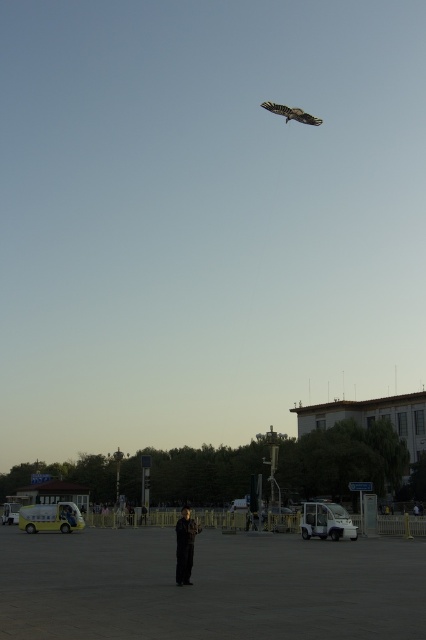
You are a drone operator who needs to fly a drone from the dark gray suit at center to the brown wooden kite at upper center. The drone has a maximum range of 200 feet. Can you safely reach the kite without exceeding the drone range?

The distance between the dark gray suit at center and the brown wooden kite at upper center is 200.17 feet, which exceeds the drone range of 200 feet. Therefore, the drone cannot safely reach the kite without exceeding its maximum range.

You are standing in the plaza and want to walk from point (187, 580) to point (314, 120). Which direction should you move to get closer to your destination?

To move from point (187, 580) to point (314, 120), you should move towards the direction away from the viewer since point (314, 120) is further away than point (187, 580).

You are a photographer trying to capture a clear photo of the dark gray suit at center without the brown wooden kite at upper center appearing in the frame. What adjustment can you make to your camera position to achieve this?

Since the dark gray suit at center is in front of the brown wooden kite at upper center, you can move your camera position lower to angle the shot so the kite is out of the frame while still capturing the suit clearly.